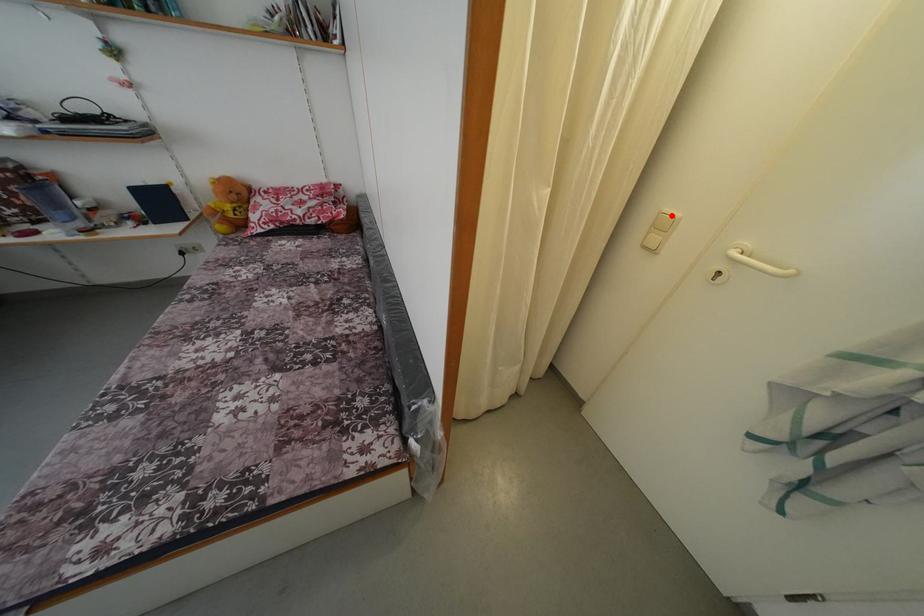
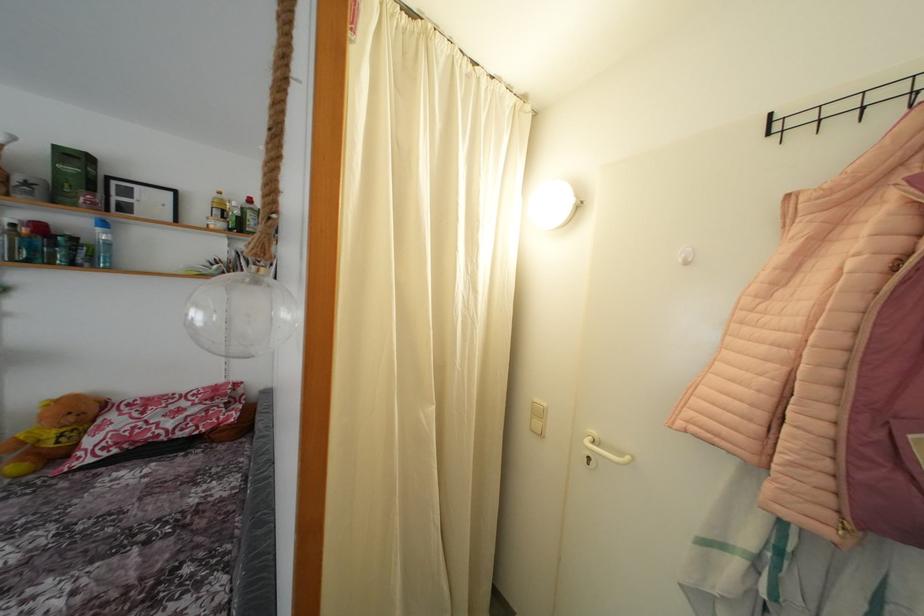
In the second image, find the point that corresponds to the highlighted location in the first image.

(541, 406)